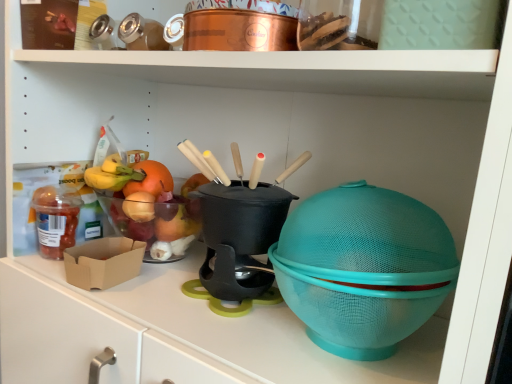
Question: Visually, is black plastic pot at center positioned to the left or to the right of translucent plastic container at left?

Choices:
 (A) right
 (B) left

Answer: (A)

Question: Is black plastic pot at center inside or outside of translucent plastic container at left?

Choices:
 (A) outside
 (B) inside

Answer: (A)

Question: From a real-world perspective, relative to translucent plastic container at left, is black plastic pot at center vertically above or below?

Choices:
 (A) below
 (B) above

Answer: (B)

Question: Do you think translucent plastic container at left is within black plastic pot at center, or outside of it?

Choices:
 (A) outside
 (B) inside

Answer: (A)

Question: Relative to black plastic pot at center, is translucent plastic container at left in front or behind?

Choices:
 (A) front
 (B) behind

Answer: (B)

Question: Is translucent plastic container at left wider or thinner than black plastic pot at center?

Choices:
 (A) wide
 (B) thin

Answer: (B)

Question: Based on their positions, is translucent plastic container at left located to the left or right of black plastic pot at center?

Choices:
 (A) left
 (B) right

Answer: (A)